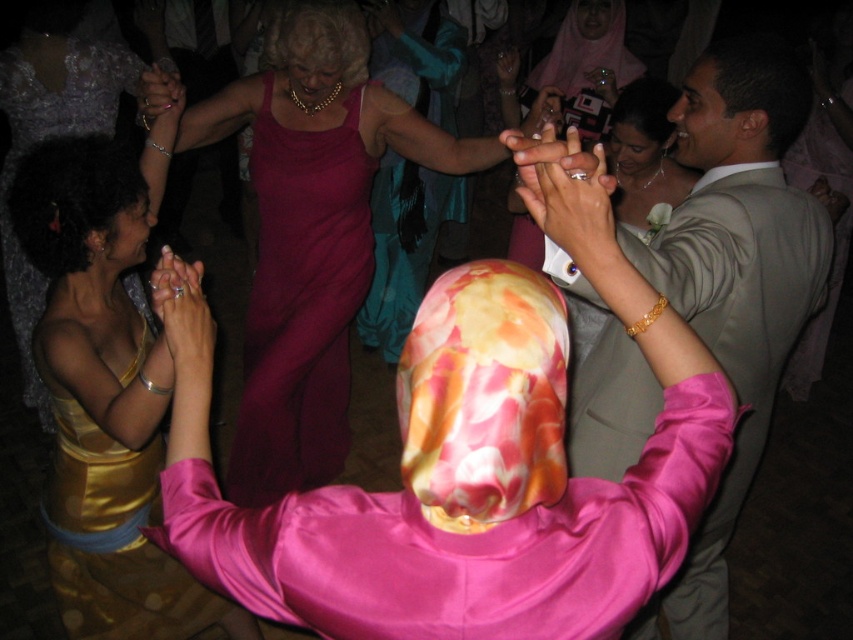
Question: Is satin pink robe at center smaller than matte beige suit at center?

Choices:
 (A) no
 (B) yes

Answer: (B)

Question: Does gold satin dress at center appear under burgundy satin dress at center?

Choices:
 (A) yes
 (B) no

Answer: (A)

Question: Which point is farther to the camera?

Choices:
 (A) (97, 61)
 (B) (344, 131)
 (C) (123, 605)

Answer: (A)

Question: Which object is positioned closest to the matte beige suit at center?

Choices:
 (A) gold satin dress at lower left
 (B) satin pink robe at center
 (C) burgundy satin dress at center

Answer: (B)

Question: Among these points, which one is farthest from the camera?

Choices:
 (A) (410, 93)
 (B) (289, 428)

Answer: (A)

Question: Does matte pink dress at center come in front of gold satin dress at center?

Choices:
 (A) yes
 (B) no

Answer: (B)